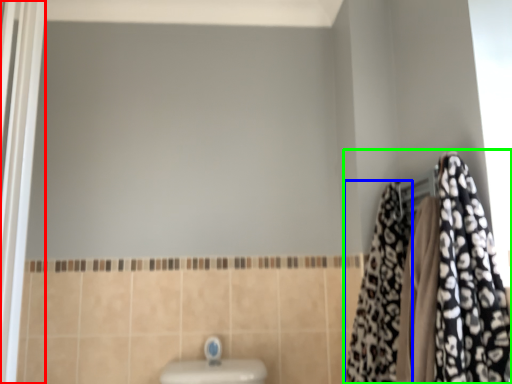
Question: Which object is positioned closest to screen door (highlighted by a red box)? Select from cloth (highlighted by a blue box) and closet (highlighted by a green box).

Choices:
 (A) cloth
 (B) closet

Answer: (A)